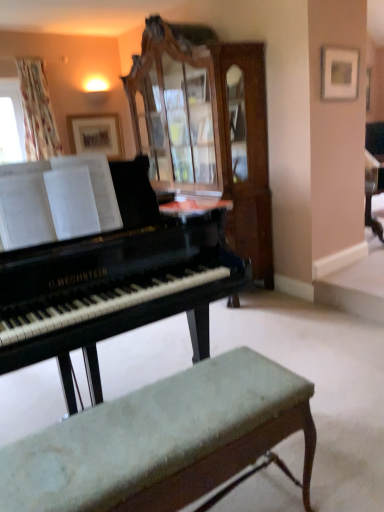
Locate an element on the screen. The width and height of the screenshot is (384, 512). vacant area on top of velvet green bench at lower center (from a real-world perspective) is located at coordinates (155, 415).